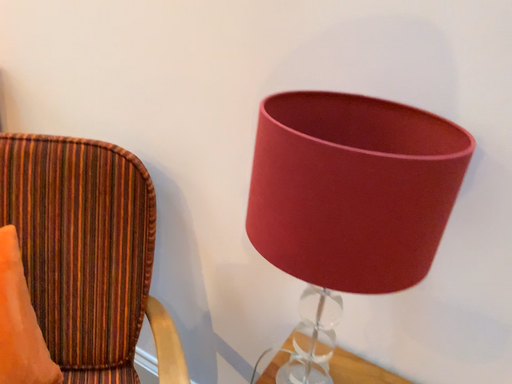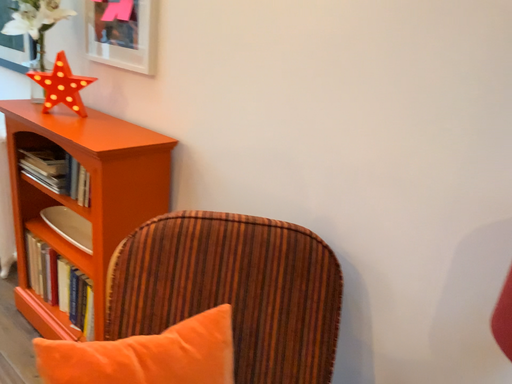
Question: Which way did the camera rotate in the video?

Choices:
 (A) rotated left
 (B) rotated right

Answer: (A)